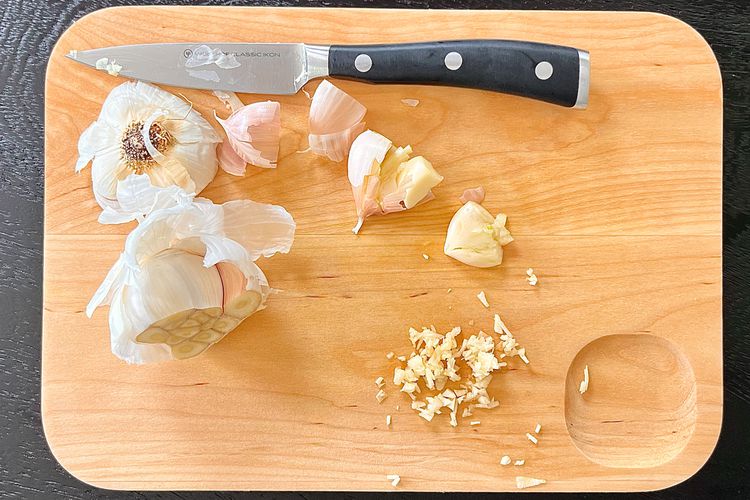
The height and width of the screenshot is (500, 750). I want to click on handle, so click(x=372, y=62), click(x=448, y=58), click(x=520, y=64).